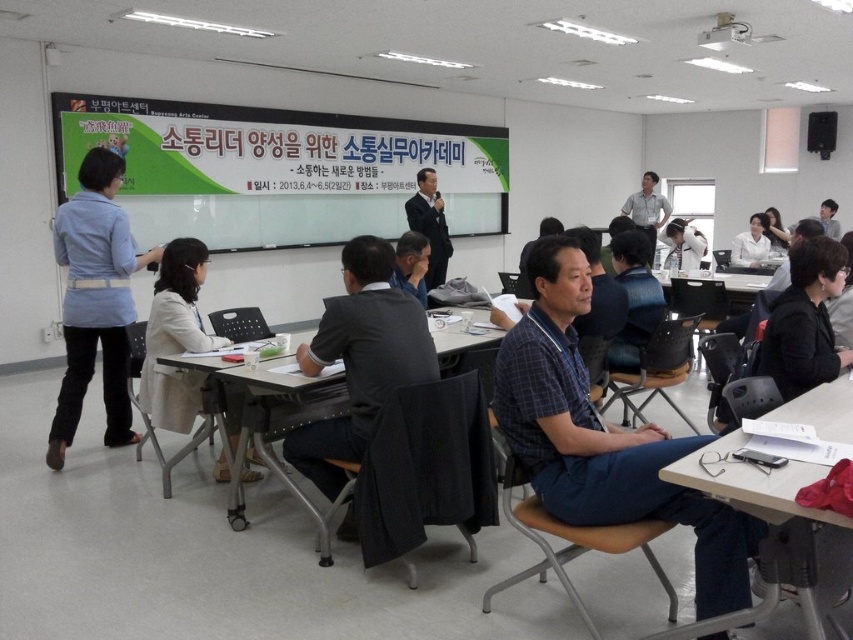
This screenshot has width=853, height=640. Describe the element at coordinates (764, 522) in the screenshot. I see `white plastic table at lower right` at that location.

Does white plastic table at lower right appear on the right side of matte black suit at upper center?

Correct, you'll find white plastic table at lower right to the right of matte black suit at upper center.

Is point (805, 589) behind point (418, 211)?

That is False.

Where is `white plastic table at lower right`? white plastic table at lower right is located at coordinates (764, 522).

The image size is (853, 640). In order to click on white plastic table at lower right in this screenshot , I will do `click(764, 522)`.

Is point (811, 404) positioned behind point (850, 364)?

No, it is not.

Identify the location of white plastic table at lower right. (764, 522).

Who is positioned more to the right, blue plaid shirt at center or dark gray suit at center?

blue plaid shirt at center

Which of these two, blue plaid shirt at center or dark gray suit at center, stands taller?

dark gray suit at center is taller.

Which is in front, point (648, 506) or point (346, 381)?

Positioned in front is point (648, 506).

You are a GUI agent. You are given a task and a screenshot of the screen. Output one action in this format:
    pyautogui.click(x=<x>, y=<y>)
    Task: Click on the blue plaid shirt at center
    
    Given the screenshot: What is the action you would take?
    pyautogui.click(x=602, y=436)